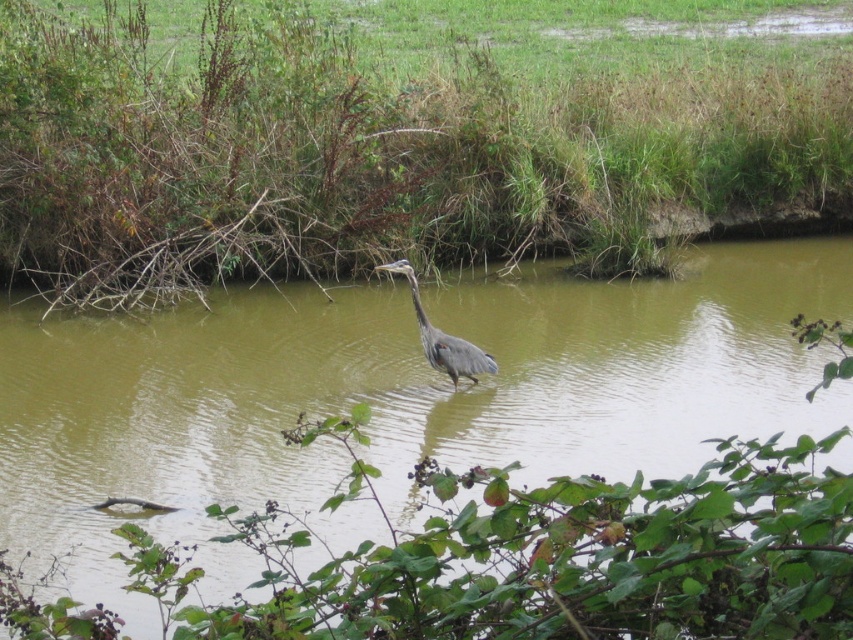
You are standing at the edge of the water and want to place a small wooden stake exactly at the location of the green grass at center. What are the coordinates where you should place it?

The coordinates for the green grass at center are point (363, 156).

In the scene shown: You are a photographer trying to capture the entire gray matte heron at center in your shot. The brown murky water at center is blocking part of the heron. Can you adjust your camera angle to ensure the heron is fully visible without the water obscuring it?

The brown murky water at center is bigger than the gray matte heron at center, so adjusting the camera angle might not be sufficient to fully reveal the heron as the water occupies more space in the frame.